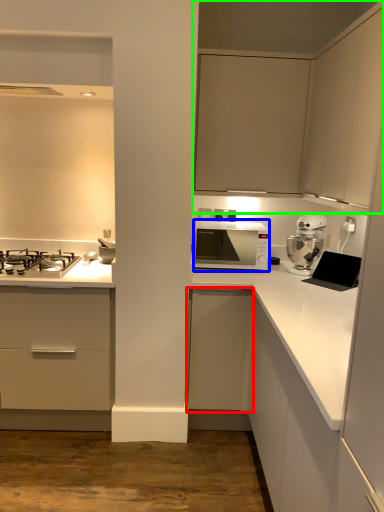
Question: Based on their relative distances, which object is nearer to cabinetry (highlighted by a red box)? Choose from microwave oven (highlighted by a blue box) and cabinetry (highlighted by a green box).

Choices:
 (A) microwave oven
 (B) cabinetry

Answer: (A)